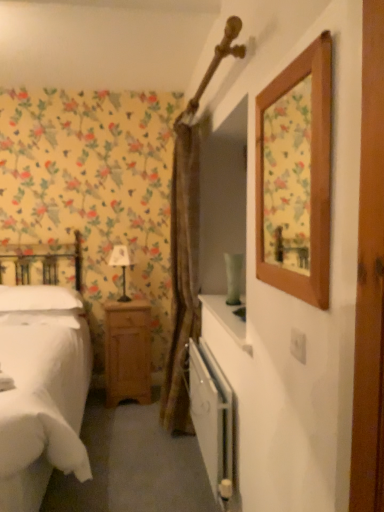
Question: Is brown textured curtain at center to the left of white metallic radiator at lower center from the viewer's perspective?

Choices:
 (A) no
 (B) yes

Answer: (B)

Question: Is brown textured curtain at center at the right side of white metallic radiator at lower center?

Choices:
 (A) no
 (B) yes

Answer: (A)

Question: Can you confirm if brown textured curtain at center is thinner than white metallic radiator at lower center?

Choices:
 (A) yes
 (B) no

Answer: (B)

Question: Is brown textured curtain at center in front of white metallic radiator at lower center?

Choices:
 (A) no
 (B) yes

Answer: (A)

Question: Could you tell me if brown textured curtain at center is facing white metallic radiator at lower center?

Choices:
 (A) yes
 (B) no

Answer: (B)

Question: Is white fabric-covered table lamp at center-left taller or shorter than white metallic radiator at lower center?

Choices:
 (A) short
 (B) tall

Answer: (A)

Question: Considering the positions of white fabric-covered table lamp at center-left and white metallic radiator at lower center in the image, is white fabric-covered table lamp at center-left wider or thinner than white metallic radiator at lower center?

Choices:
 (A) wide
 (B) thin

Answer: (A)

Question: Is white fabric-covered table lamp at center-left to the left or to the right of white metallic radiator at lower center in the image?

Choices:
 (A) left
 (B) right

Answer: (A)

Question: In the image, is white fabric-covered table lamp at center-left positioned in front of or behind white metallic radiator at lower center?

Choices:
 (A) front
 (B) behind

Answer: (B)

Question: From the image's perspective, is white fabric-covered table lamp at center-left positioned above or below brown textured curtain at center?

Choices:
 (A) above
 (B) below

Answer: (A)

Question: Is white fabric-covered table lamp at center-left taller or shorter than brown textured curtain at center?

Choices:
 (A) short
 (B) tall

Answer: (A)

Question: Is point (112, 256) positioned closer to the camera than point (183, 147)?

Choices:
 (A) closer
 (B) farther

Answer: (B)

Question: Looking at their shapes, would you say white fabric-covered table lamp at center-left is wider or thinner than brown textured curtain at center?

Choices:
 (A) wide
 (B) thin

Answer: (B)

Question: In terms of height, does light brown wood nightstand at lower left look taller or shorter compared to white fabric-covered table lamp at center-left?

Choices:
 (A) short
 (B) tall

Answer: (B)

Question: Relative to white fabric-covered table lamp at center-left, is light brown wood nightstand at lower left in front or behind?

Choices:
 (A) front
 (B) behind

Answer: (A)